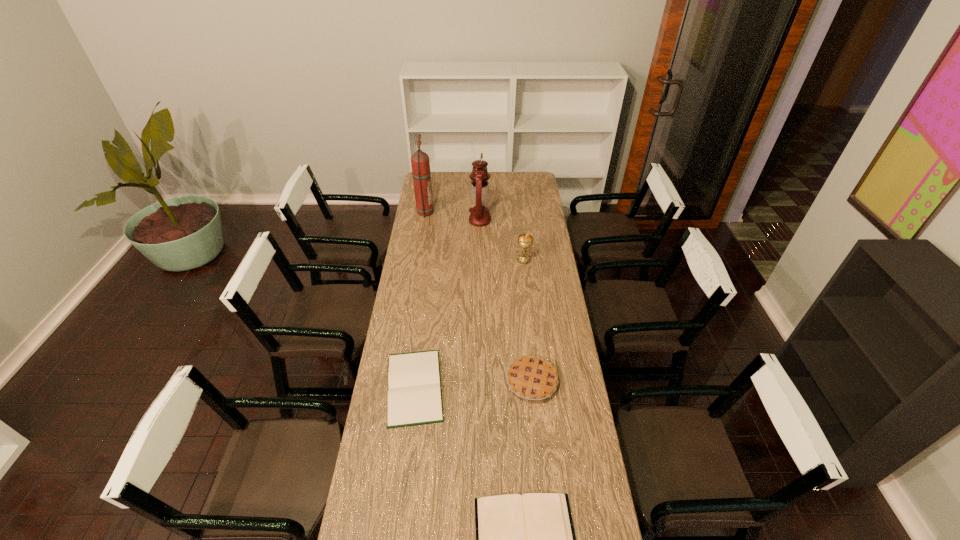
Find the location of a particular element. The height and width of the screenshot is (540, 960). fire extinguisher is located at coordinates (420, 163).

In order to click on oil lamp in this screenshot , I will do `click(479, 216)`.

This screenshot has height=540, width=960. In order to click on the fourth nearest object in this screenshot , I will do `click(525, 241)`.

Locate an element on the screen. the third tallest object is located at coordinates (525, 241).

You are a GUI agent. You are given a task and a screenshot of the screen. Output one action in this format:
    pyautogui.click(x=<x>, y=<y>)
    Task: Click on the pie
    This screenshot has height=540, width=960.
    Given the screenshot: What is the action you would take?
    pyautogui.click(x=530, y=377)

Identify the location of the left hardback book. The image size is (960, 540). (414, 397).

The height and width of the screenshot is (540, 960). I want to click on free space located 0.390m on the side of the fire extinguisher with the label and nozzle, so click(501, 212).

The image size is (960, 540). Find the location of `vacant space located on the right of the oil lamp`. vacant space located on the right of the oil lamp is located at coordinates (528, 220).

Identify the location of free spot located 0.340m on the front of the chalice. (530, 315).

Image resolution: width=960 pixels, height=540 pixels. I want to click on vacant space located on the left of the fourth tallest object, so click(437, 381).